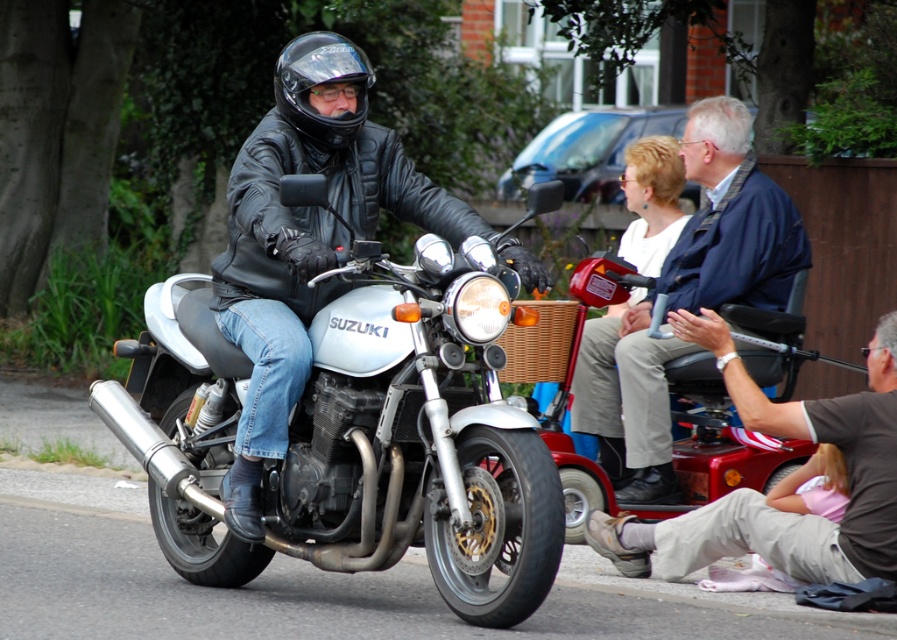
Does silver metallic motorcycle at center appear over black matte helmet at center?

No.

Between silver metallic motorcycle at center and black matte helmet at center, which one has less height?

black matte helmet at center

Who is more distant from viewer, (x=341, y=221) or (x=329, y=147)?

The point (x=329, y=147) is more distant.

This screenshot has height=640, width=897. Identify the location of silver metallic motorcycle at center. (371, 442).

Does blue denim jacket at upper center lie in front of brown leather jacket at lower right?

No, blue denim jacket at upper center is further to the viewer.

Which is in front, point (671, 298) or point (814, 436)?

Point (814, 436)

Image resolution: width=897 pixels, height=640 pixels. What are the coordinates of `blue denim jacket at upper center` in the screenshot? It's located at (686, 298).

Can you confirm if blue denim jacket at upper center is wider than black matte helmet at center?

Yes.

Does point (675, 284) come farther from viewer compared to point (327, 128)?

Yes, it is behind point (327, 128).

Identify the location of blue denim jacket at upper center. The image size is (897, 640). (686, 298).

Where is `blue denim jacket at upper center`? This screenshot has width=897, height=640. blue denim jacket at upper center is located at coordinates (686, 298).